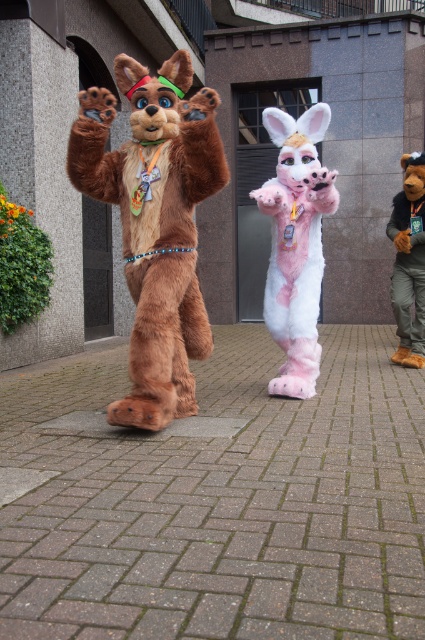
Question: Which object is closer to the camera taking this photo?

Choices:
 (A) pink furry costume at center
 (B) fuzzy brown bear at right
 (C) fuzzy pink fur at center

Answer: (C)

Question: Does fuzzy pink fur at center have a greater width compared to fuzzy brown bear at right?

Choices:
 (A) yes
 (B) no

Answer: (A)

Question: Considering the relative positions of fuzzy pink fur at center and pink furry costume at center in the image provided, where is fuzzy pink fur at center located with respect to pink furry costume at center?

Choices:
 (A) above
 (B) below

Answer: (A)

Question: Which object is farther from the camera taking this photo?

Choices:
 (A) pink furry costume at center
 (B) fuzzy brown bear at right
 (C) fuzzy pink fur at center

Answer: (B)

Question: Does pink furry costume at center have a lesser width compared to fuzzy brown bear at right?

Choices:
 (A) no
 (B) yes

Answer: (A)

Question: Which point is closer to the camera taking this photo?

Choices:
 (A) (187, 412)
 (B) (410, 156)

Answer: (A)